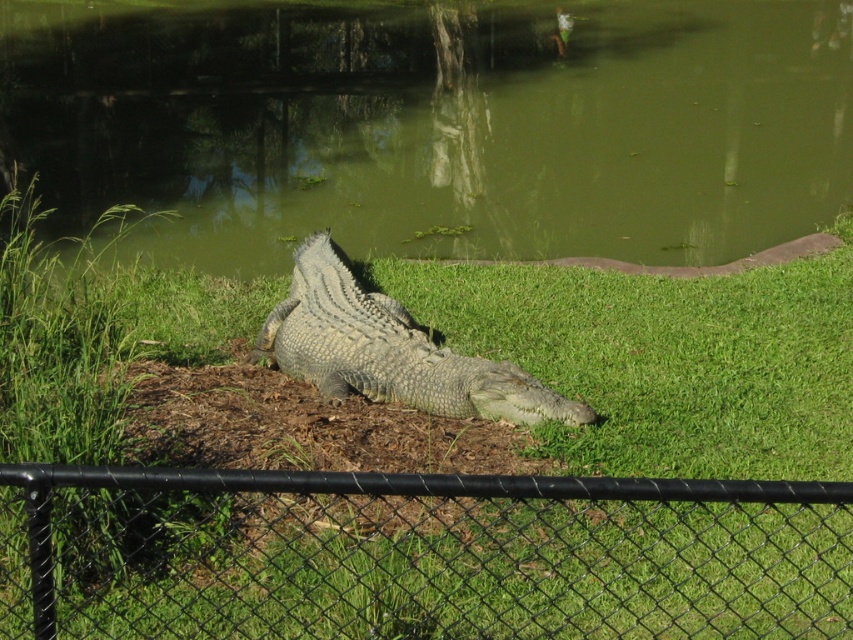
Does green grassy at center appear on the left side of gray scaly crocodile at center?

In fact, green grassy at center is to the right of gray scaly crocodile at center.

In the scene shown: Does green grassy at center have a greater width compared to gray scaly crocodile at center?

In fact, green grassy at center might be narrower than gray scaly crocodile at center.

In order to click on green grassy at center in this screenshot , I will do `click(474, 484)`.

Can you confirm if green grassy at center is smaller than black chain-link fence at center?

Indeed, green grassy at center has a smaller size compared to black chain-link fence at center.

Can you confirm if green grassy at center is positioned to the right of black chain-link fence at center?

Indeed, green grassy at center is positioned on the right side of black chain-link fence at center.

Between point (670, 371) and point (62, 544), which one is positioned in front?

Positioned in front is point (62, 544).

Identify the location of green grassy at center. (474, 484).

Is green murky water at center positioned behind gray scaly crocodile at center?

Yes.

Is point (386, 100) closer to camera compared to point (315, 352)?

That is False.

At what (x,y) coordinates should I click in order to perform the action: click on green murky water at center. Please return your answer as a coordinate pair (x, y). The height and width of the screenshot is (640, 853). Looking at the image, I should click on (434, 125).